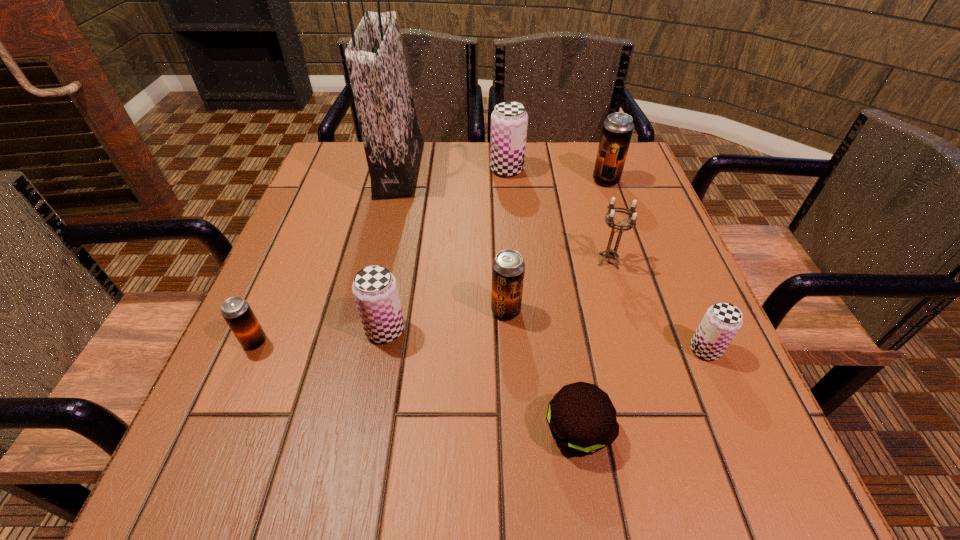
Find the location of a particular element. The height and width of the screenshot is (540, 960). the rightmost beer can is located at coordinates (722, 321).

This screenshot has height=540, width=960. Identify the location of the rightmost purple beer can. (722, 321).

Locate an element on the screen. The image size is (960, 540). the leftmost black beer can is located at coordinates (239, 316).

Locate an element on the screen. the nearest black beer can is located at coordinates (239, 316).

Find the location of a particular element. The image size is (960, 540). patty is located at coordinates point(582,419).

This screenshot has height=540, width=960. Identify the location of the shortest object. (582, 419).

In order to click on vacant space located on the front of the shopping bag with the design in this screenshot , I will do `click(556, 170)`.

The image size is (960, 540). Identify the location of vacant space positioned on the front of the second beer can from right to left. (618, 217).

Locate an element on the screen. The height and width of the screenshot is (540, 960). free space located on the front of the biggest purple beer can is located at coordinates (514, 259).

Identify the location of vacant space located on the back of the candle holder. (590, 197).